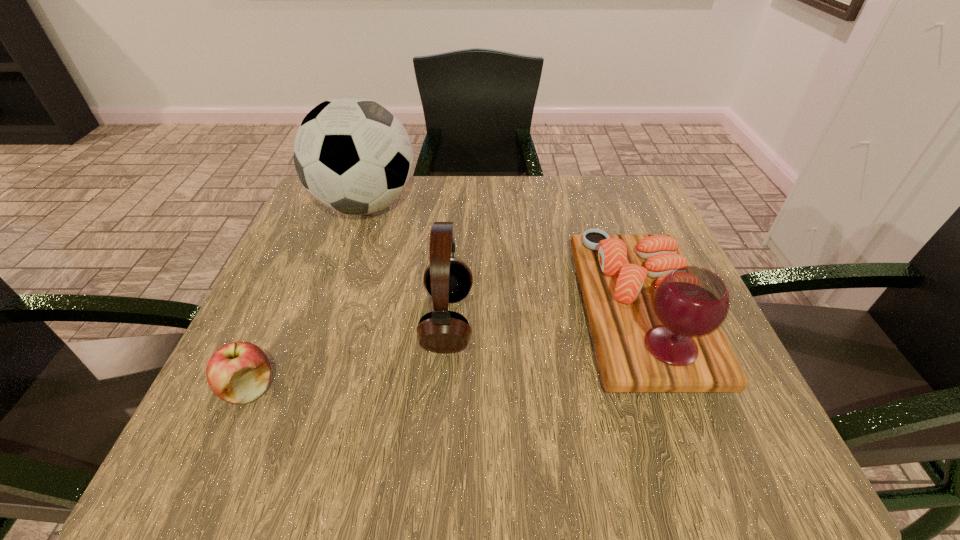
Where is `free point that satisfies the following two spatial constraints: 1. on the ear pads of the third object from left to right; 2. on the front side of the shortest object`? Image resolution: width=960 pixels, height=540 pixels. free point that satisfies the following two spatial constraints: 1. on the ear pads of the third object from left to right; 2. on the front side of the shortest object is located at coordinates (443, 388).